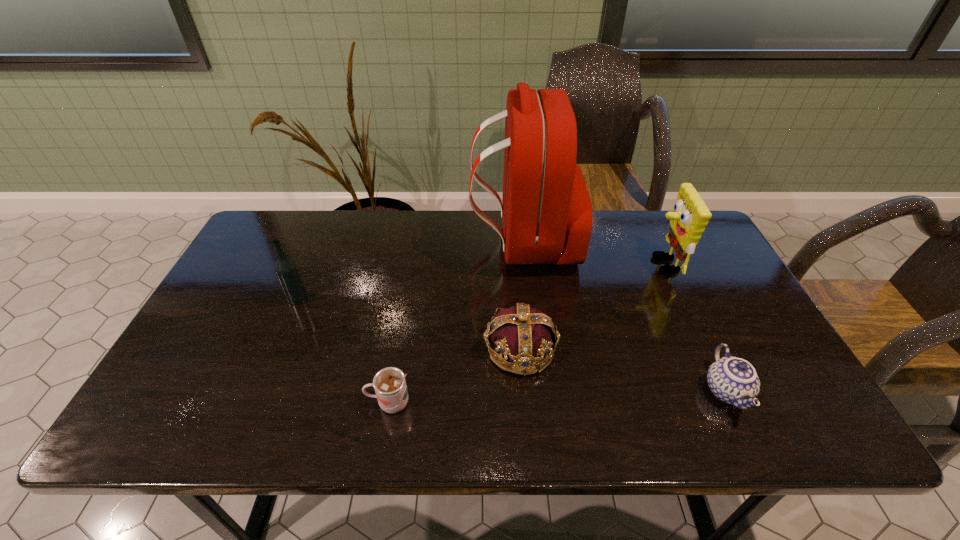
At what (x,y) coordinates should I click in order to perform the action: click on vacant area located 0.300m on the face of the fifth shortest object. Please return your answer as a coordinate pair (x, y). Looking at the image, I should click on (548, 265).

I want to click on free space located 0.210m on the face of the fifth shortest object, so click(578, 265).

Find the location of a particular element. vacant area situated on the face of the fifth shortest object is located at coordinates point(568,265).

The image size is (960, 540). I want to click on vacant space situated 0.260m on the back of the leftmost object, so click(324, 235).

Locate an element on the screen. The image size is (960, 540). vacant space located 0.140m on the front of the fourth tallest object is located at coordinates click(x=528, y=436).

What are the coordinates of `vacant space located 0.130m on the side with the handle of the second object from left to right` in the screenshot? It's located at (307, 403).

The width and height of the screenshot is (960, 540). Identify the location of free space located 0.150m on the side with the handle of the second object from left to right. (298, 403).

Where is `vacant region located on the side with the handle of the second object from left to right`? The image size is (960, 540). vacant region located on the side with the handle of the second object from left to right is located at coordinates (212, 403).

Identify the location of backpack located at the far edge. This screenshot has height=540, width=960. (547, 214).

Identify the location of sponge that is at the far edge. The height and width of the screenshot is (540, 960). (690, 217).